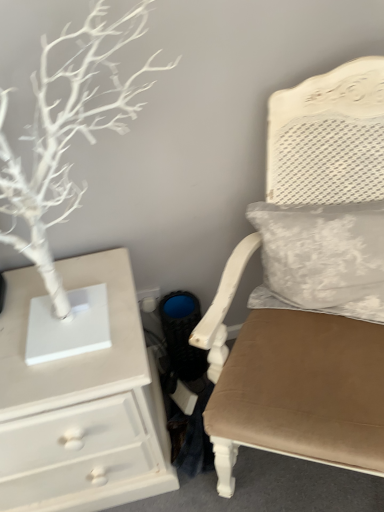
Question: Does velvet beige chair at center have a greater width compared to white painted wood chest of drawers at left?

Choices:
 (A) yes
 (B) no

Answer: (A)

Question: Can you confirm if velvet beige chair at center is positioned to the right of white painted wood chest of drawers at left?

Choices:
 (A) yes
 (B) no

Answer: (A)

Question: From the image's perspective, is velvet beige chair at center located beneath white painted wood chest of drawers at left?

Choices:
 (A) yes
 (B) no

Answer: (B)

Question: Does velvet beige chair at center have a lesser width compared to white painted wood chest of drawers at left?

Choices:
 (A) no
 (B) yes

Answer: (A)

Question: From a real-world perspective, is velvet beige chair at center positioned under white painted wood chest of drawers at left based on gravity?

Choices:
 (A) yes
 (B) no

Answer: (B)

Question: Which is correct: white matte tree at left is inside velvet beige chair at center, or outside of it?

Choices:
 (A) outside
 (B) inside

Answer: (A)

Question: Is point (92, 20) positioned closer to the camera than point (299, 146)?

Choices:
 (A) farther
 (B) closer

Answer: (B)

Question: In terms of width, does white matte tree at left look wider or thinner when compared to velvet beige chair at center?

Choices:
 (A) wide
 (B) thin

Answer: (B)

Question: Visually, is white matte tree at left positioned to the left or to the right of velvet beige chair at center?

Choices:
 (A) right
 (B) left

Answer: (B)

Question: Is velvet beige chair at center inside or outside of white painted wood chest of drawers at left?

Choices:
 (A) outside
 (B) inside

Answer: (A)

Question: Considering the positions of velvet beige chair at center and white painted wood chest of drawers at left in the image, is velvet beige chair at center taller or shorter than white painted wood chest of drawers at left?

Choices:
 (A) short
 (B) tall

Answer: (B)

Question: In terms of width, does velvet beige chair at center look wider or thinner when compared to white painted wood chest of drawers at left?

Choices:
 (A) thin
 (B) wide

Answer: (B)

Question: From a real-world perspective, is velvet beige chair at center physically located above or below white painted wood chest of drawers at left?

Choices:
 (A) below
 (B) above

Answer: (B)

Question: Is point (307, 90) closer or farther from the camera than point (360, 252)?

Choices:
 (A) closer
 (B) farther

Answer: (A)

Question: Is velvet beige chair at center bigger or smaller than white textured pillow at upper right?

Choices:
 (A) small
 (B) big

Answer: (B)